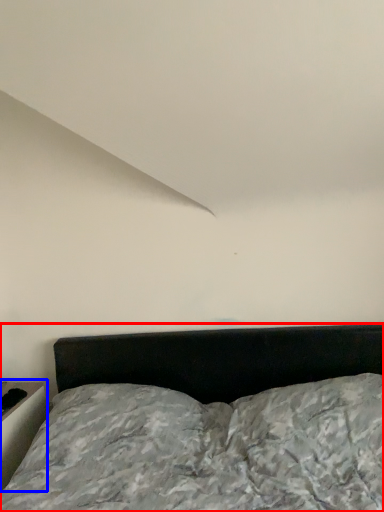
Question: Which object appears closest to the camera in this image, bed (highlighted by a red box) or table (highlighted by a blue box)?

Choices:
 (A) bed
 (B) table

Answer: (A)